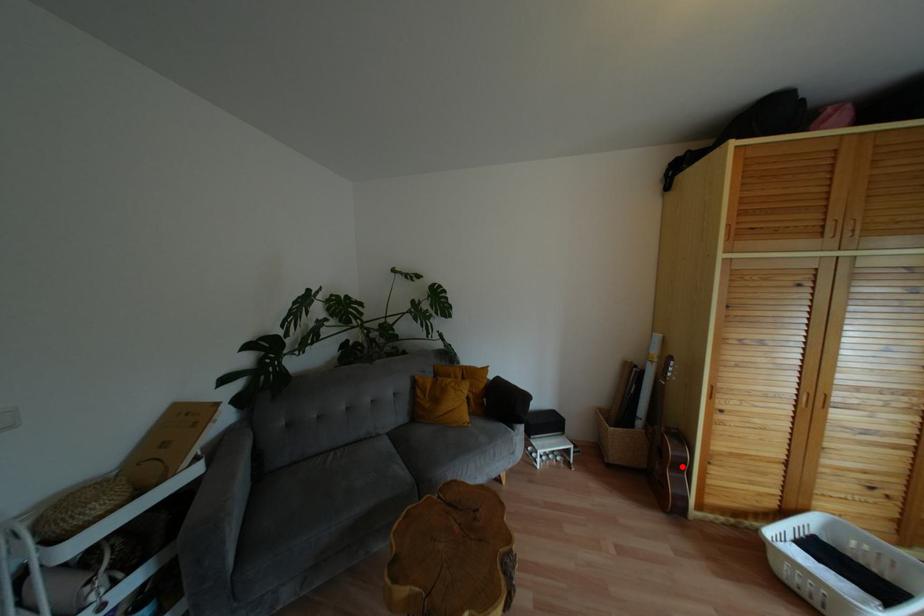
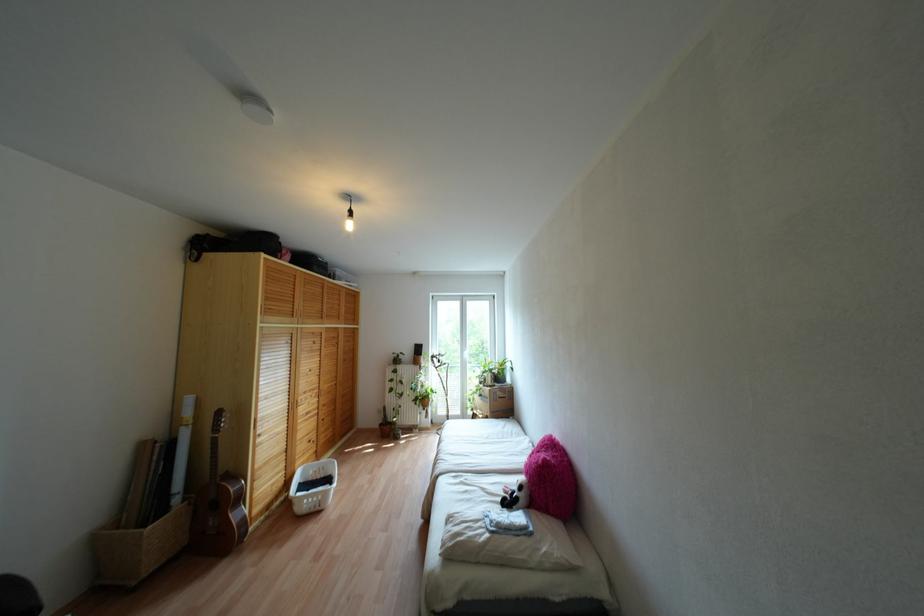
Where in the second image is the point corresponding to the highlighted location from the first image?

(238, 498)